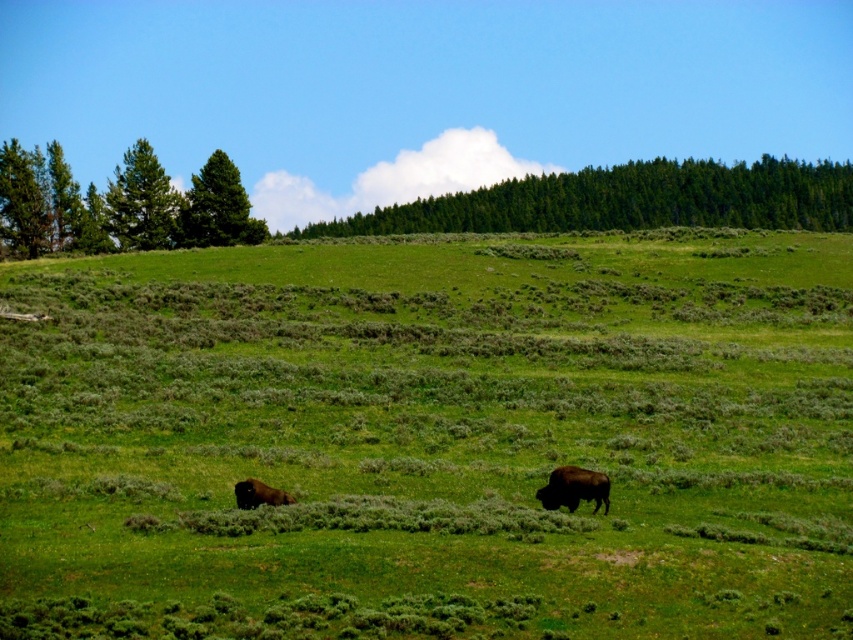
You are standing in the grassy field and want to walk towards the two trees at the upper left corner. Which one will you reach first, the green textured pine tree at upper left or the green coniferous tree at upper left?

You will reach the green textured pine tree at upper left first because it is closer to you than the green coniferous tree at upper left.

You are standing at the edge of the grassy field in the image and want to reach the dense line of evergreen trees in the background. There is a point marked at coordinates point (544, 547). If you walk straight towards the trees, will you pass by this point?

The distance between point (544, 547) and the viewer is 23.41 meters. Since the point is located along the path towards the trees, you will pass by point (544, 547) on your way to the dense line of evergreen trees.